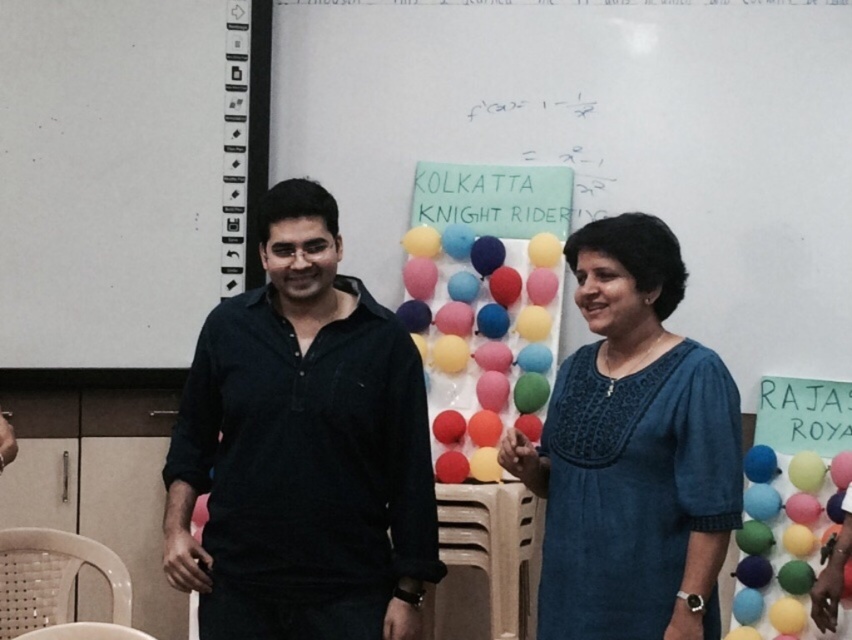
Question: Does colorful balloons at center appear on the right side of white paper at upper left?

Choices:
 (A) yes
 (B) no

Answer: (A)

Question: Among these objects, which one is farthest from the camera?

Choices:
 (A) colorful balloons at center
 (B) white paper at upper left

Answer: (A)

Question: Among these points, which one is farthest from the camera?

Choices:
 (A) (579, 52)
 (B) (246, 113)

Answer: (A)

Question: Which point is closer to the camera?

Choices:
 (A) white paper at upper left
 (B) blue cotton dress at center

Answer: (B)

Question: Considering the relative positions of colorful balloons at center and blue cotton dress at center in the image provided, where is colorful balloons at center located with respect to blue cotton dress at center?

Choices:
 (A) below
 (B) above

Answer: (B)

Question: Can you confirm if black cotton shirt at center is wider than blue cotton dress at center?

Choices:
 (A) yes
 (B) no

Answer: (A)